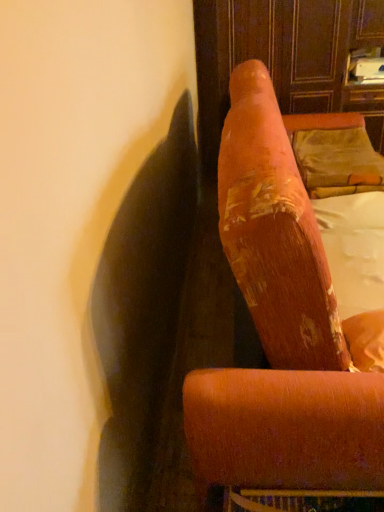
Question: Is velvet orange armchair at upper right aimed at white fabric at upper right?

Choices:
 (A) no
 (B) yes

Answer: (B)

Question: Is velvet orange armchair at upper right to the left of white fabric at upper right from the viewer's perspective?

Choices:
 (A) no
 (B) yes

Answer: (B)

Question: Is the depth of velvet orange armchair at upper right greater than that of white fabric at upper right?

Choices:
 (A) no
 (B) yes

Answer: (A)

Question: Does velvet orange armchair at upper right have a greater width compared to white fabric at upper right?

Choices:
 (A) yes
 (B) no

Answer: (A)

Question: From a real-world perspective, is velvet orange armchair at upper right located higher than white fabric at upper right?

Choices:
 (A) no
 (B) yes

Answer: (B)

Question: Considering the positions of velvet orange armchair at upper right and velvet gold pillow at upper right in the image, is velvet orange armchair at upper right taller or shorter than velvet gold pillow at upper right?

Choices:
 (A) short
 (B) tall

Answer: (B)

Question: From a real-world perspective, is velvet orange armchair at upper right physically located above or below velvet gold pillow at upper right?

Choices:
 (A) above
 (B) below

Answer: (B)

Question: Is point (238, 184) positioned closer to the camera than point (321, 163)?

Choices:
 (A) farther
 (B) closer

Answer: (B)

Question: Is velvet orange armchair at upper right wider or thinner than velvet gold pillow at upper right?

Choices:
 (A) wide
 (B) thin

Answer: (A)

Question: In terms of width, does velvet gold pillow at upper right look wider or thinner when compared to velvet orange armchair at upper right?

Choices:
 (A) wide
 (B) thin

Answer: (B)

Question: From the image's perspective, relative to velvet orange armchair at upper right, is velvet gold pillow at upper right above or below?

Choices:
 (A) above
 (B) below

Answer: (A)

Question: Is velvet gold pillow at upper right in front of or behind velvet orange armchair at upper right in the image?

Choices:
 (A) front
 (B) behind

Answer: (B)

Question: From a real-world perspective, is velvet gold pillow at upper right above or below velvet orange armchair at upper right?

Choices:
 (A) below
 (B) above

Answer: (B)

Question: Does point (362, 187) appear closer or farther from the camera than point (329, 231)?

Choices:
 (A) closer
 (B) farther

Answer: (B)

Question: Looking at their shapes, would you say velvet gold pillow at upper right is wider or thinner than white fabric at upper right?

Choices:
 (A) wide
 (B) thin

Answer: (A)